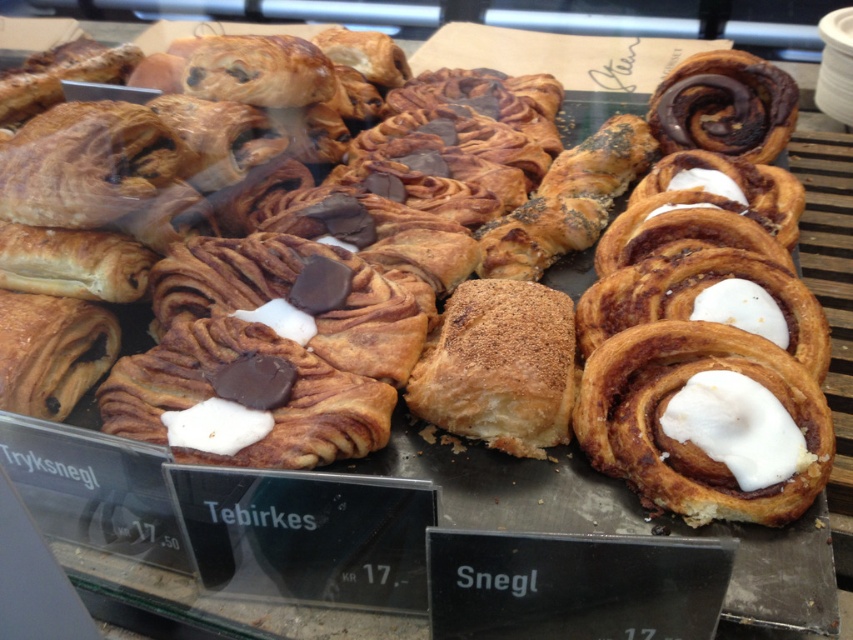
Question: Considering the real-world distances, which object is closest to the white glossy cinnamon roll at center?

Choices:
 (A) chocolate swirled bun at upper right
 (B) chocolate-coated pastry at center
 (C) chocolate chip croissant at center

Answer: (B)

Question: Does cinnamon-sugar croissant at center appear under chocolate chip croissant at center?

Choices:
 (A) no
 (B) yes

Answer: (B)

Question: Which of these objects is positioned farthest from the chocolate swirled bun at upper right?

Choices:
 (A) white glossy cinnamon roll at center
 (B) chocolate-coated pastry at center
 (C) cinnamon-sugar croissant at center
 (D) chocolate chip croissant at center

Answer: (B)

Question: Does white glossy cinnamon roll at center appear on the left side of chocolate-coated pastry at center?

Choices:
 (A) yes
 (B) no

Answer: (B)

Question: Does chocolate-coated pastry at center have a larger size compared to cinnamon-sugar croissant at center?

Choices:
 (A) no
 (B) yes

Answer: (B)

Question: Estimate the real-world distances between objects in this image. Which object is closer to the chocolate chip croissant at center?

Choices:
 (A) cinnamon-sugar croissant at center
 (B) white glossy cinnamon roll at center
 (C) chocolate swirled bun at upper right
 (D) chocolate-coated pastry at center

Answer: (C)